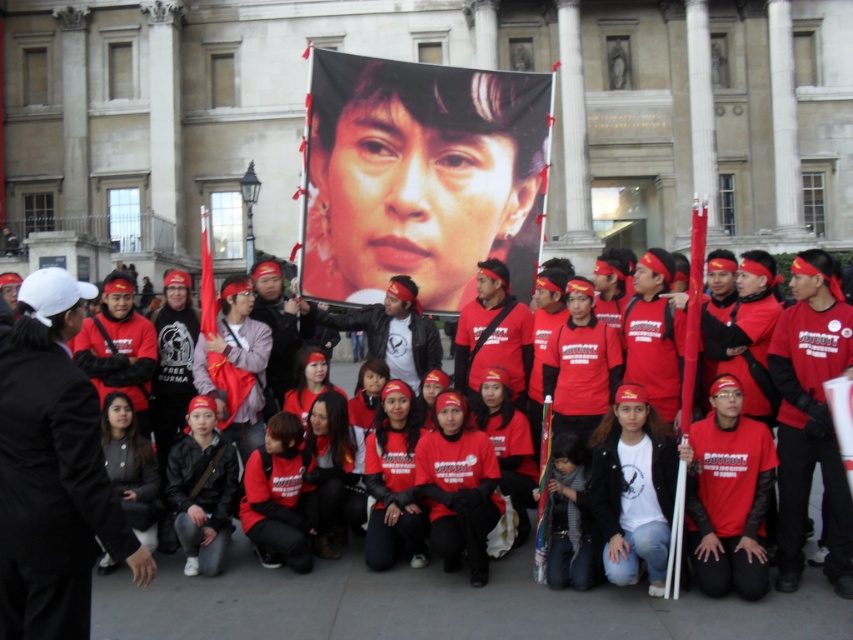
Between matte black banner at upper center and matte red shirt at center, which one is positioned lower?

matte black banner at upper center is below.

Who is taller, matte black banner at upper center or matte red shirt at center?

matte red shirt at center is taller.

Is point (437, 618) positioned in front of point (144, 349)?

Yes.

You are a GUI agent. You are given a task and a screenshot of the screen. Output one action in this format:
    pyautogui.click(x=<x>, y=<y>)
    Task: Click on the matte black banner at upper center
    This screenshot has height=640, width=853.
    Given the screenshot: What is the action you would take?
    pyautogui.click(x=436, y=604)

In the scene shown: Does matte black jacket at center have a lesser height compared to matte red shirt at center?

No.

Between matte black jacket at center and matte red shirt at center, which one is positioned higher?

matte red shirt at center is above.

Between point (35, 429) and point (148, 337), which one is positioned in front?

Positioned in front is point (35, 429).

Where is `matte black jacket at center`? The width and height of the screenshot is (853, 640). matte black jacket at center is located at coordinates (51, 472).

How distant is matte black banner at upper center from matte black jacket at center?

The distance of matte black banner at upper center from matte black jacket at center is 8.04 meters.

Can you confirm if matte black banner at upper center is bigger than matte black jacket at center?

Correct, matte black banner at upper center is larger in size than matte black jacket at center.

Which is in front, point (573, 609) or point (20, 602)?

Point (20, 602) is in front.

Where is `matte black banner at upper center`? Image resolution: width=853 pixels, height=640 pixels. matte black banner at upper center is located at coordinates (436, 604).